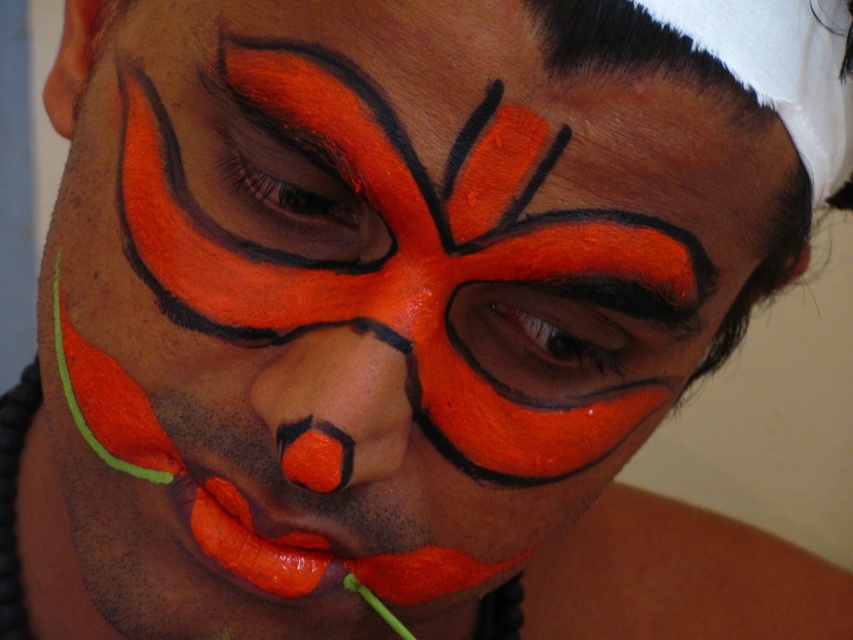
Does point (347, 465) come closer to viewer compared to point (349, 561)?

Yes, it is.

Can you confirm if matte orange nose at center is wider than matte orange lips at center?

Incorrect, matte orange nose at center's width does not surpass matte orange lips at center's.

Which is behind, point (332, 461) or point (204, 545)?

Point (204, 545)

This screenshot has width=853, height=640. Find the location of `matte orange nose at center`. matte orange nose at center is located at coordinates (335, 406).

Which is in front, point (405, 362) or point (589, 8)?

Point (589, 8) is in front.

Image resolution: width=853 pixels, height=640 pixels. What do you see at coordinates (335, 406) in the screenshot?
I see `matte orange nose at center` at bounding box center [335, 406].

Is point (344, 416) more distant than point (590, 61)?

Yes, it is behind point (590, 61).

In order to click on matte orange nose at center in this screenshot , I will do `click(335, 406)`.

Between point (633, 45) and point (274, 588), which one is positioned behind?

Positioned behind is point (274, 588).

Which is in front, point (728, 90) or point (251, 548)?

Point (728, 90) is in front.

Image resolution: width=853 pixels, height=640 pixels. In order to click on matte orange face paint at upper center in this screenshot , I will do `click(639, 52)`.